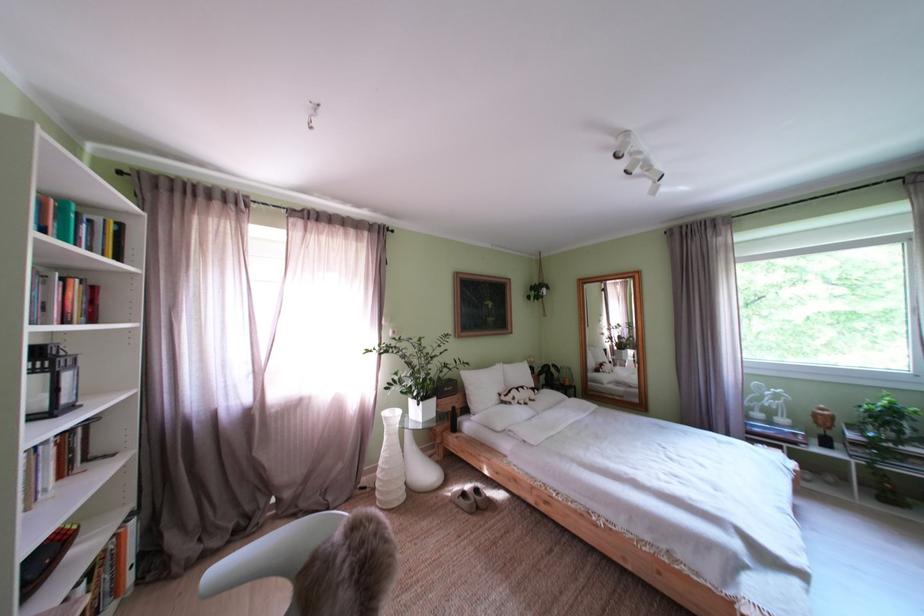
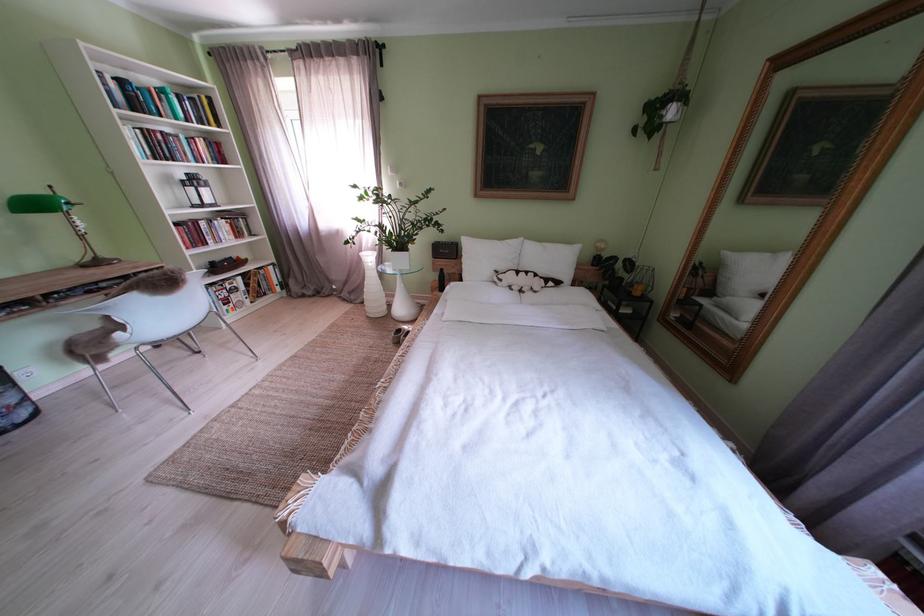
Locate, in the second image, the point that corresponds to [492,392] in the first image.

(490, 262)